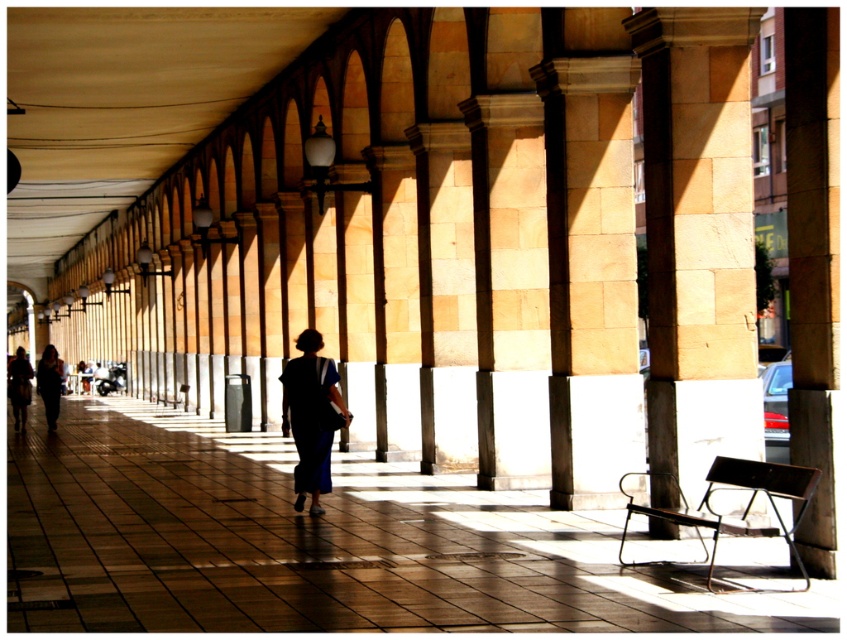
You are standing in the arcade and notice both the beige stone pillar at center and the dark blue fabric dress at center. Which object is shorter in height?

The beige stone pillar at center is shorter in height compared to the dark blue fabric dress at center.

You are standing at the entrance of the arcade and see a beige stone pillar at center. If you walk straight ahead, will you eventually reach the point indicated by the coordinates (698, 236)?

Yes, walking straight ahead from the entrance will lead you to the beige stone pillar at center, which is located at the coordinates (698, 236).

You are standing at the entrance of the arcade and want to reach the dark blue fabric dress at center without getting too close to the beige stone pillar at center. What is the minimum distance you need to walk to avoid the pillar?

The minimum distance you need to walk to avoid the beige stone pillar at center is 3.72 meters, as the pillar is exactly that distance away from the dark blue fabric dress at center.